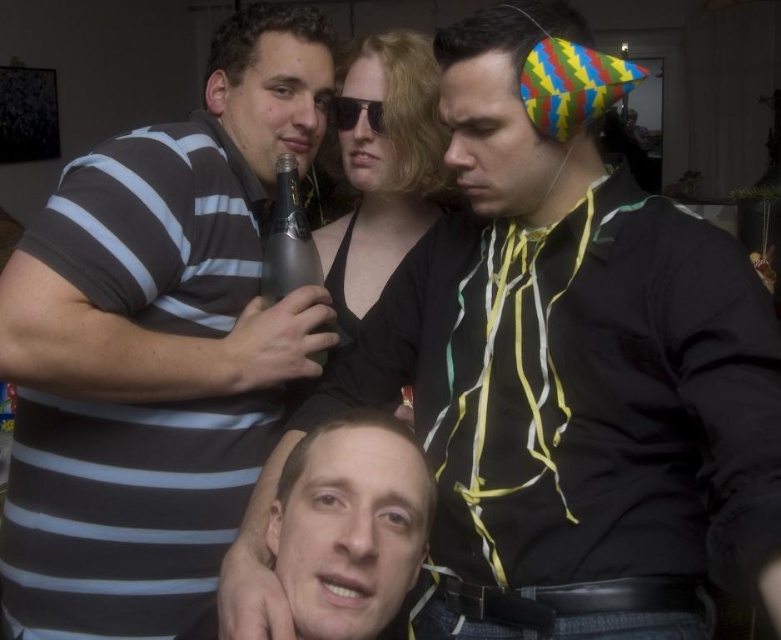
Which is below, striped cotton shirt at upper left or smooth skin face at center?

smooth skin face at center is lower down.

You are a GUI agent. You are given a task and a screenshot of the screen. Output one action in this format:
    pyautogui.click(x=<x>, y=<y>)
    Task: Click on the striped cotton shirt at upper left
    The width and height of the screenshot is (781, 640).
    Given the screenshot: What is the action you would take?
    pyautogui.click(x=558, y=364)

Can you confirm if striped cotton shirt at left is thinner than silver metallic bottle at upper center?

No.

Can you confirm if striped cotton shirt at left is bigger than silver metallic bottle at upper center?

Indeed, striped cotton shirt at left has a larger size compared to silver metallic bottle at upper center.

Is point (248, 298) positioned in front of point (309, 278)?

Yes, point (248, 298) is closer to viewer.

At what (x,y) coordinates should I click in order to perform the action: click on striped cotton shirt at left. Please return your answer as a coordinate pair (x, y). The height and width of the screenshot is (640, 781). Looking at the image, I should click on (155, 346).

Which of these two, striped cotton shirt at upper left or silver metallic bottle at upper center, stands taller?

With more height is striped cotton shirt at upper left.

Who is shorter, striped cotton shirt at upper left or silver metallic bottle at upper center?

With less height is silver metallic bottle at upper center.

Describe the element at coordinates (558, 364) in the screenshot. I see `striped cotton shirt at upper left` at that location.

This screenshot has height=640, width=781. Identify the location of striped cotton shirt at upper left. (558, 364).